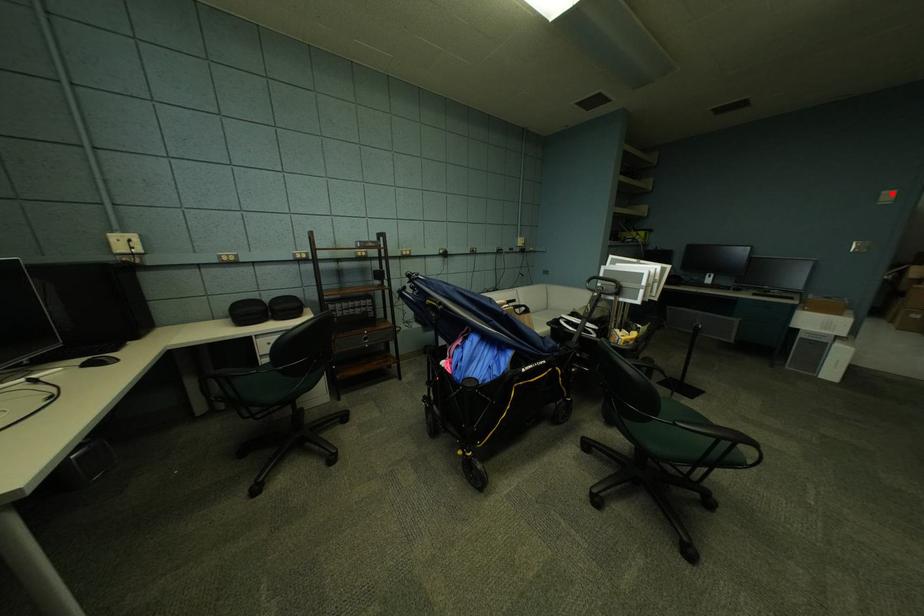
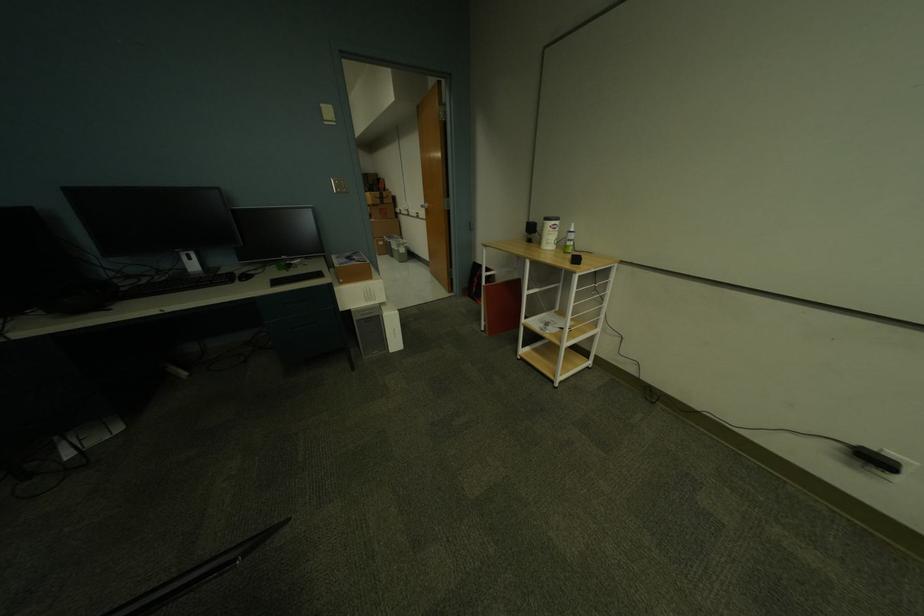
Locate, in the second image, the point that corresponds to the highlighted location in the first image.

(331, 107)